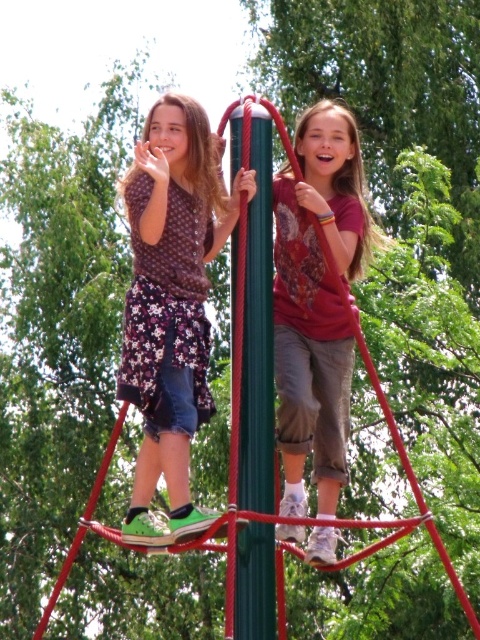
Which is below, floral fabric skirt at left or green polished pole at center?

green polished pole at center is below.

Is floral fabric skirt at left thinner than green polished pole at center?

Incorrect, floral fabric skirt at left's width is not less than green polished pole at center's.

Between point (154, 298) and point (237, 278), which one is positioned behind?

The point (237, 278) is more distant.

At what (x,y) coordinates should I click in order to perform the action: click on floral fabric skirt at left. Please return your answer as a coordinate pair (x, y). This screenshot has width=480, height=640. Looking at the image, I should click on (171, 305).

Looking at this image, which of these two, floral fabric skirt at left or matte red shirt at center, stands shorter?

With less height is floral fabric skirt at left.

Is point (145, 296) in front of point (312, 349)?

That is True.

Where is `floral fabric skirt at left`? The height and width of the screenshot is (640, 480). floral fabric skirt at left is located at coordinates (171, 305).

At what (x,y) coordinates should I click in order to perform the action: click on floral fabric skirt at left. Please return your answer as a coordinate pair (x, y). Looking at the image, I should click on (171, 305).

Does matte red shirt at center appear on the right side of green polished pole at center?

Correct, you'll find matte red shirt at center to the right of green polished pole at center.

Who is positioned more to the right, matte red shirt at center or green polished pole at center?

matte red shirt at center is more to the right.

The width and height of the screenshot is (480, 640). What do you see at coordinates (316, 301) in the screenshot?
I see `matte red shirt at center` at bounding box center [316, 301].

At what (x,y) coordinates should I click in order to perform the action: click on matte red shirt at center. Please return your answer as a coordinate pair (x, y). The height and width of the screenshot is (640, 480). Looking at the image, I should click on coord(316,301).